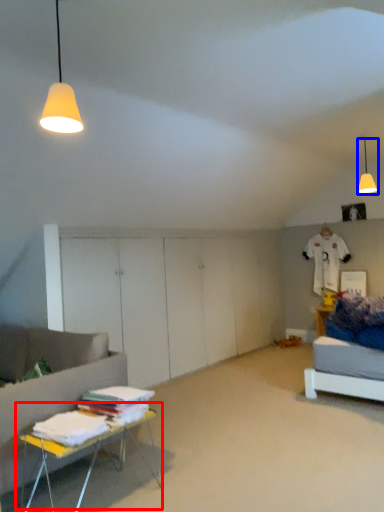
Question: Which point is closer to the camera, table (highlighted by a red box) or lamp (highlighted by a blue box)?

Choices:
 (A) table
 (B) lamp

Answer: (A)